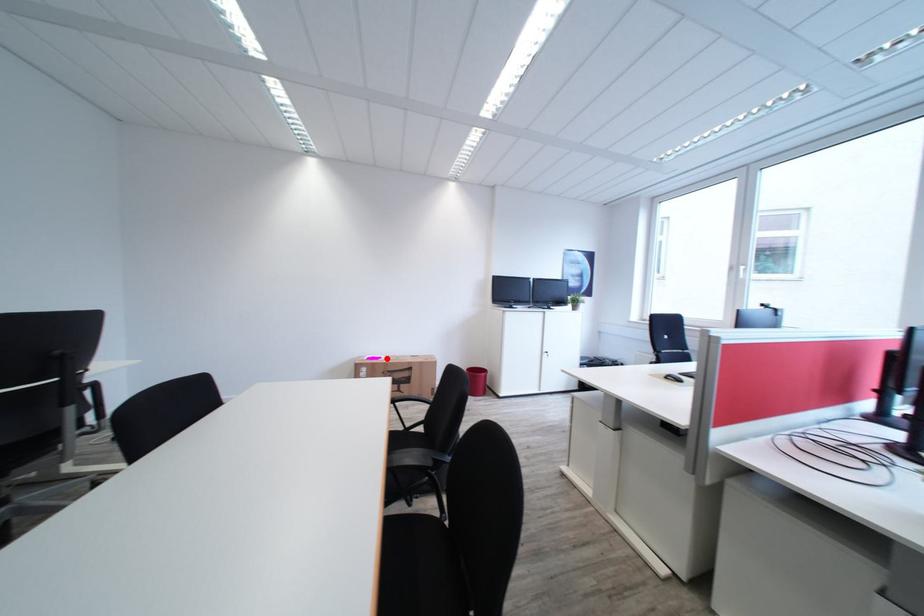
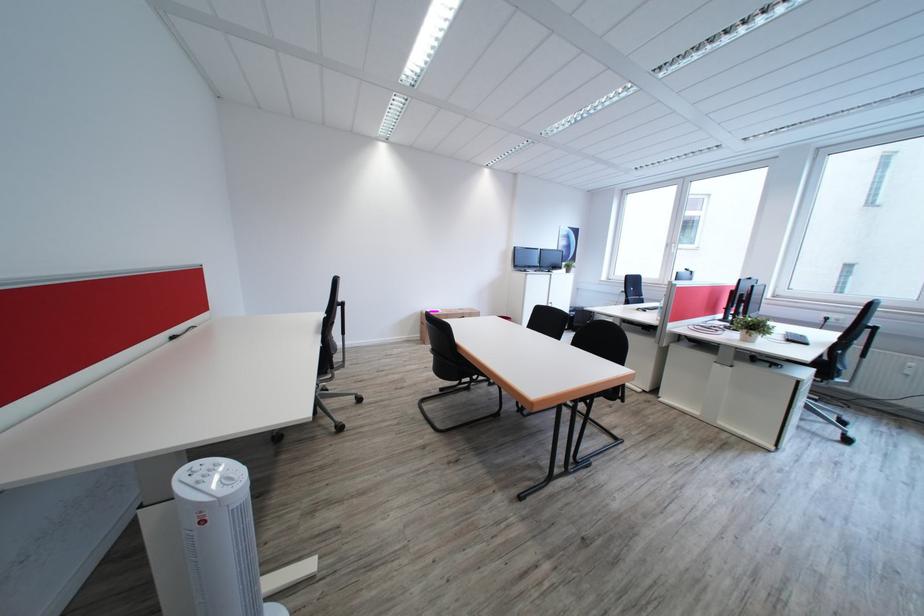
Locate, in the second image, the point that corresponds to the highlighted location in the first image.

(445, 312)